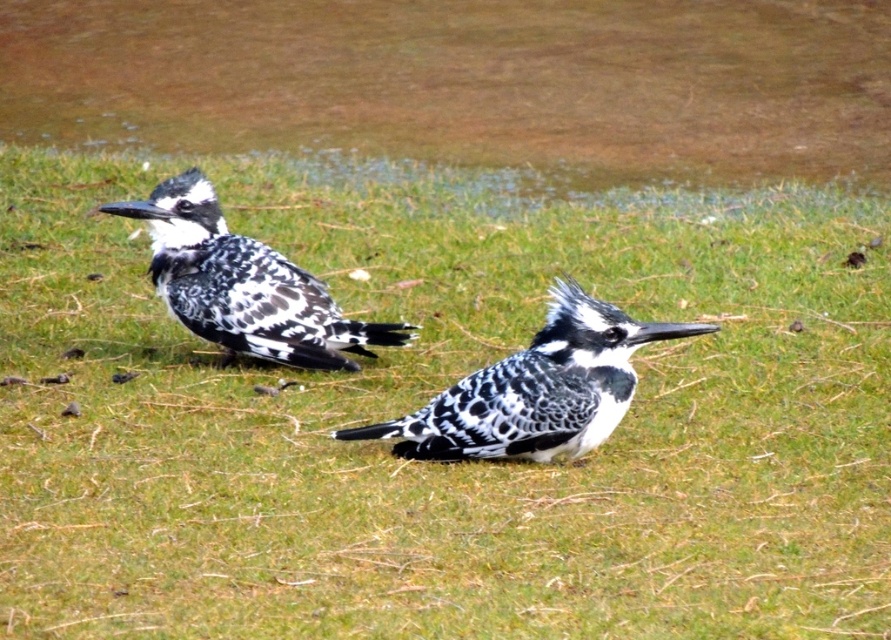
Can you confirm if speckled feathers bird at center is positioned below speckled feathered bird at left?

Indeed, speckled feathers bird at center is positioned under speckled feathered bird at left.

Is speckled feathers bird at center bigger than speckled feathered bird at left?

No, speckled feathers bird at center is not bigger than speckled feathered bird at left.

Locate an element on the screen. The width and height of the screenshot is (891, 640). speckled feathers bird at center is located at coordinates (536, 388).